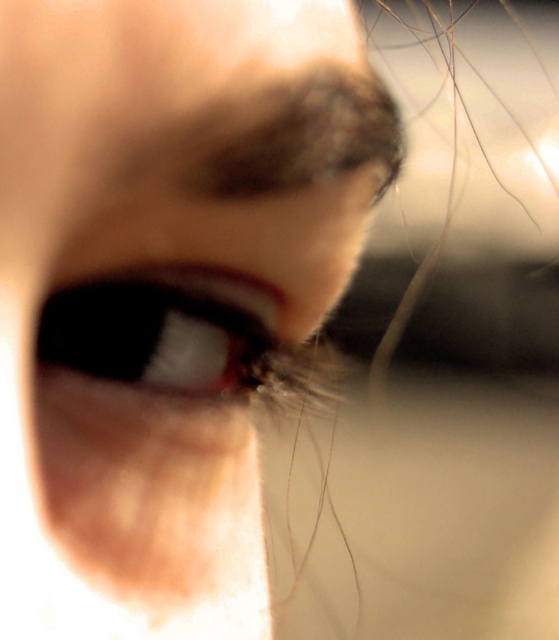
You are a makeup artist preparing to apply lipstick. You notice the pink glossy tongue at center and the satin black eye at center in your client. Which object is positioned higher in the image?

The pink glossy tongue at center is taller than the satin black eye at center, so the pink glossy tongue at center is positioned higher in the image.

You are a dentist examining a patient. You notice the pink glossy tongue at center and the teeth. How far apart are they?

The pink glossy tongue at center and the teeth are 5.26 inches apart.

You are a photographer adjusting the focus on your camera. You notice the pink glossy tongue at center and the satin black eye at center in your frame. Which object should you focus on to ensure it appears sharp if the other is slightly out of focus?

You should focus on the pink glossy tongue at center because it is closer to the viewer than the satin black eye at center, so focusing on the closer object will keep it sharp while the farther one may blur.